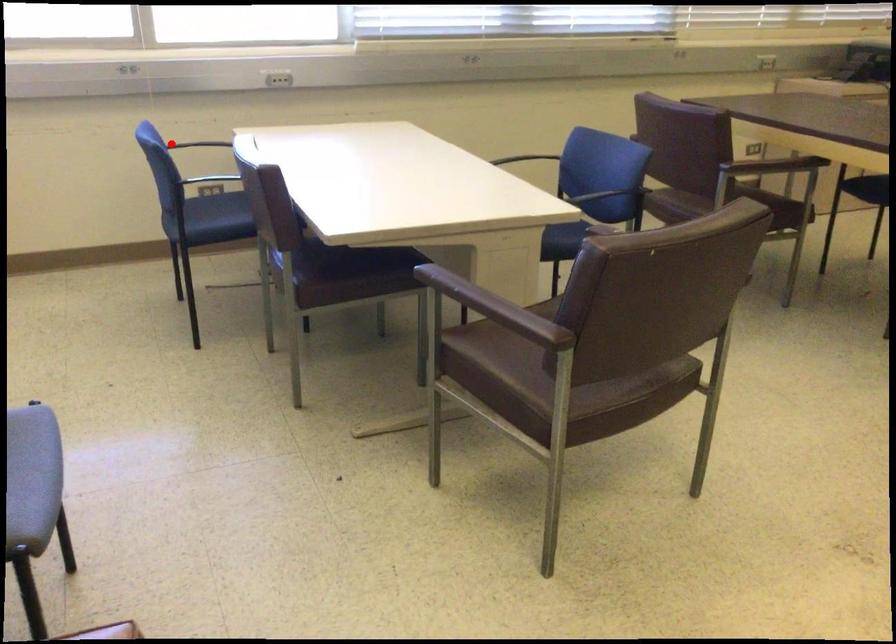
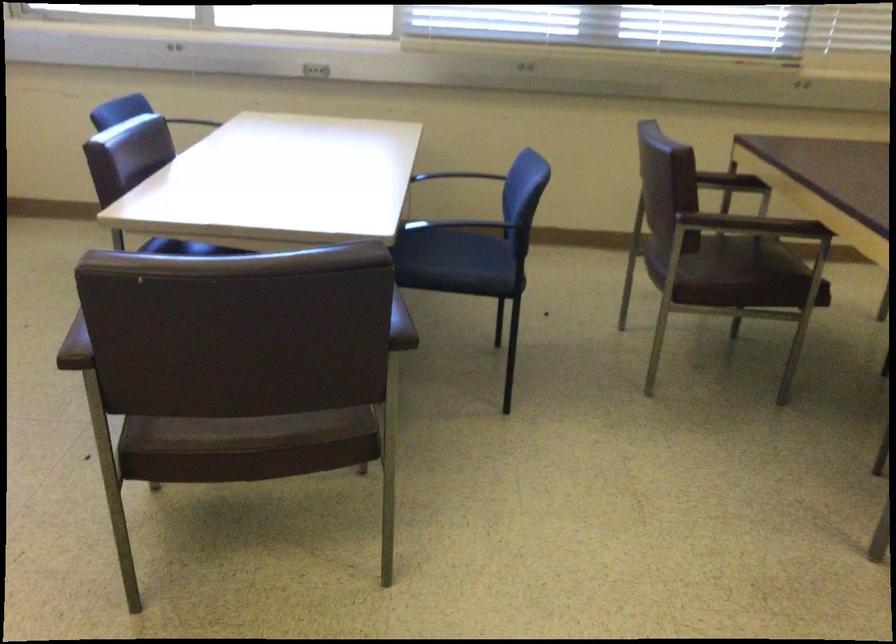
The point at the highlighted location is marked in the first image. Where is the corresponding point in the second image?

(202, 120)